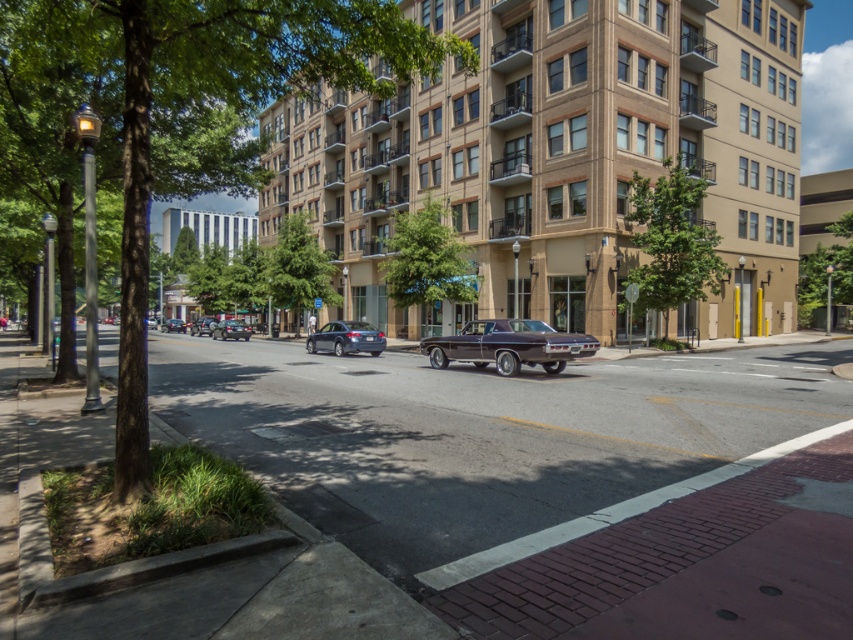
You are a pedestrian standing on the red brick sidewalk on the left side of the street. You see both the shiny blue sedan at center and the shiny black sedan at center. Which car is directly above the other?

The shiny blue sedan at center is positioned under the shiny black sedan at center, so the shiny black sedan at center is directly above the shiny blue sedan at center.

You are a pedestrian standing at the edge of the sidewalk on the left side of the road. You want to cross the street to reach a store on the opposite side. The crosswalk is located 50 meters ahead from your current position. Can you safely cross the road before the shiny black sedan at center reaches the crosswalk?

The shiny black sedan at center is currently 45.81 meters away from you. Since the crosswalk is 50 meters ahead, the sedan is closer to the crosswalk than you are. Therefore, you should wait until the sedan passes before attempting to cross.